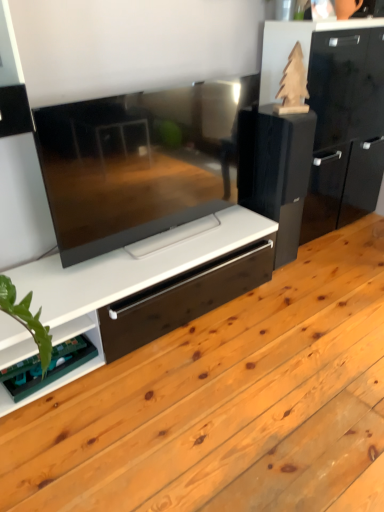
Where is `empty space that is ontop of green circuit board at lower left`? Image resolution: width=384 pixels, height=512 pixels. empty space that is ontop of green circuit board at lower left is located at coordinates (52, 357).